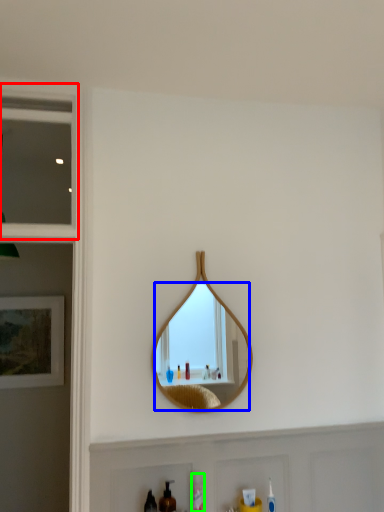
Question: Based on their relative distances, which object is nearer to window (highlighted by a red box)? Choose from mirror (highlighted by a blue box) and mouthwash (highlighted by a green box).

Choices:
 (A) mirror
 (B) mouthwash

Answer: (B)